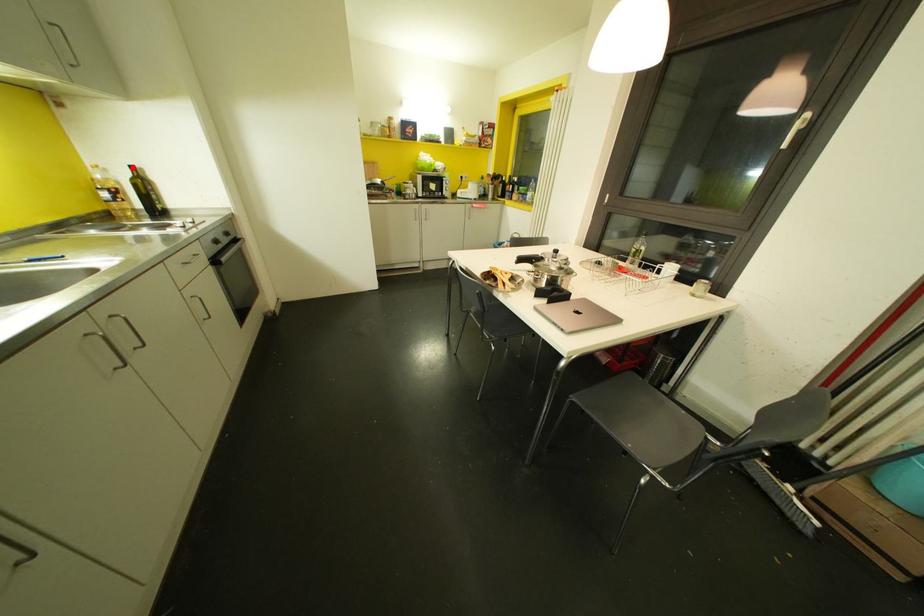
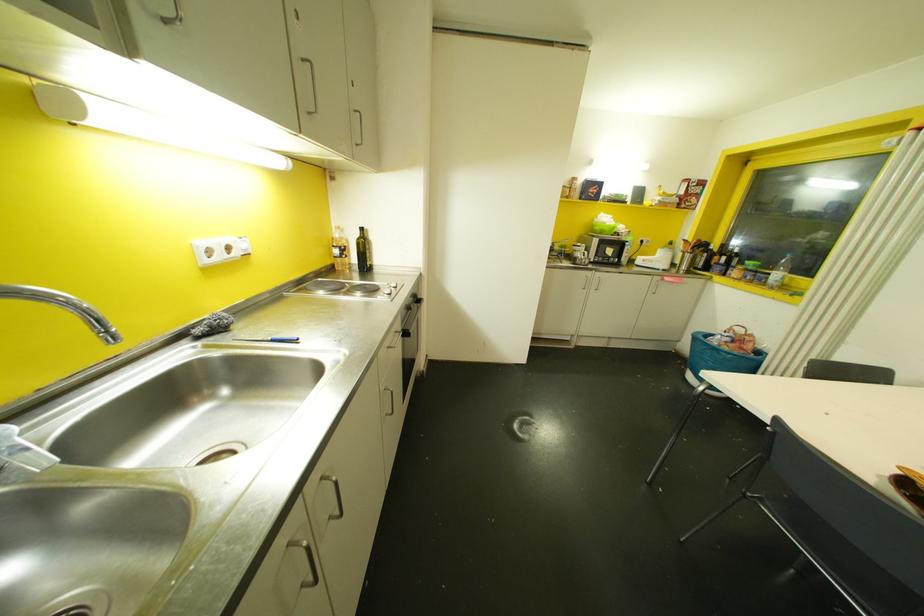
Where in the second image is the point corresponding to the highlighted location from the first image?

(360, 229)